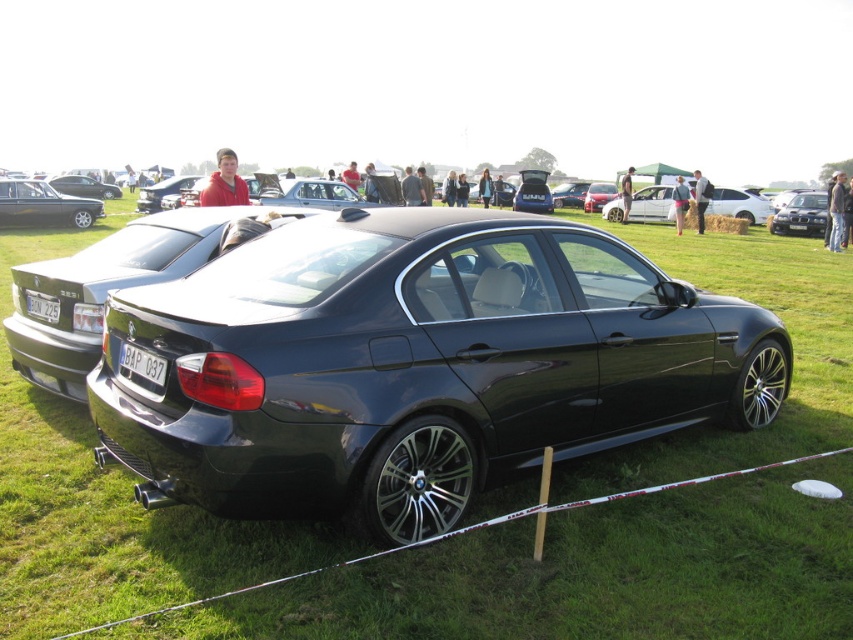
You are a photographer trying to capture the entire shiny black sedan at center and the black plastic license plate at rear in a single frame. Considering their sizes, will the license plate appear smaller than the sedan in the photo?

The black plastic license plate at rear has a lesser width compared to the shiny black sedan at center, so yes, the license plate will appear smaller than the sedan in the photo.

You are a photographer at the car show and want to take a photo of the shiny black sedan at center. However, you notice the black plastic license plate at rear might be blocking part of the car. Is the license plate on the left or right side of the sedan?

The black plastic license plate at rear is positioned on the right side of the shiny black sedan at center, so it is on the right side.

You are standing at the point with coordinates point (44, 205). Looking around, you see a shiny metallic car at left and other cars in the background. Which direction should you walk to reach the shiny metallic car at left?

The point (44, 205) is located on the shiny metallic car at left, so you are already at the shiny metallic car at left. There is no need to move.